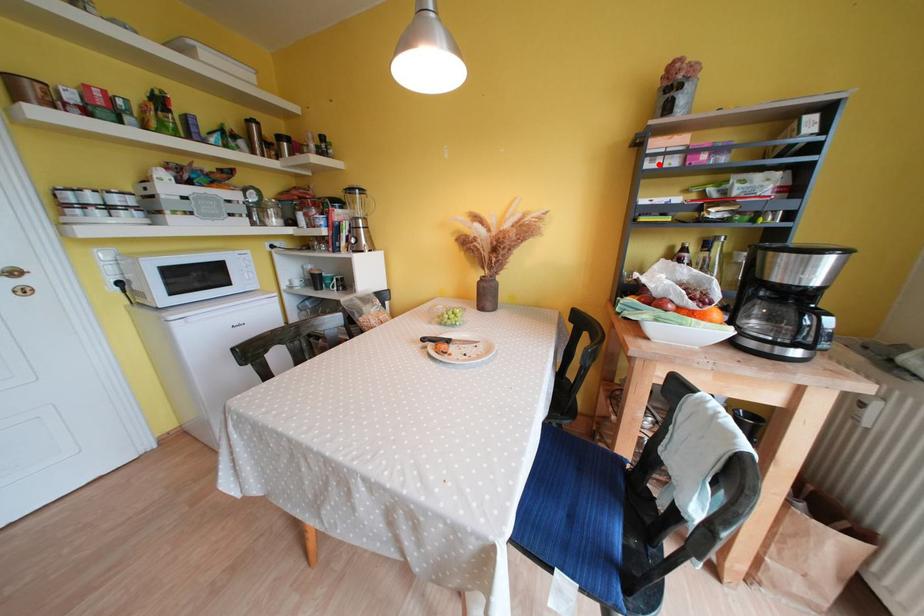
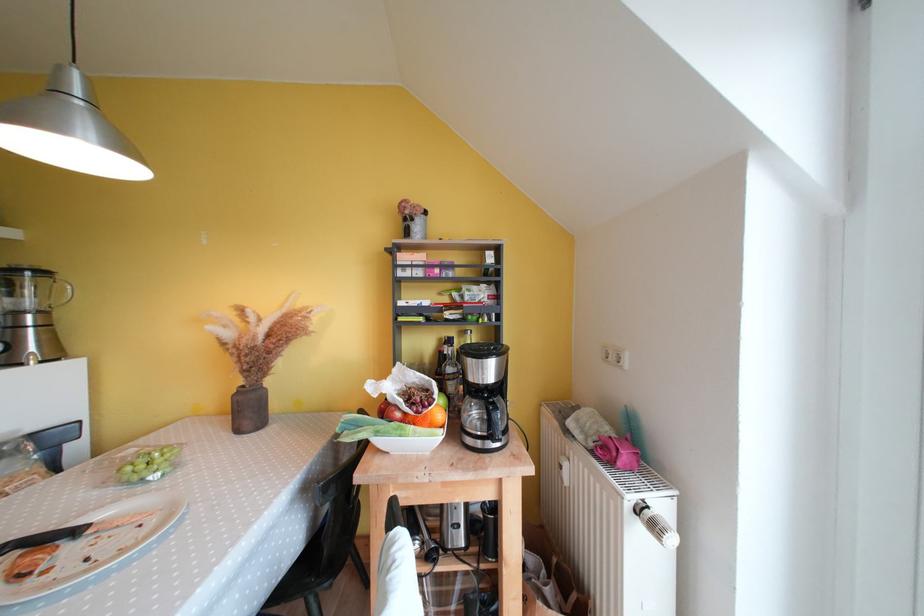
Locate, in the second image, the point that corresponds to the highlighted location in the first image.

(409, 274)